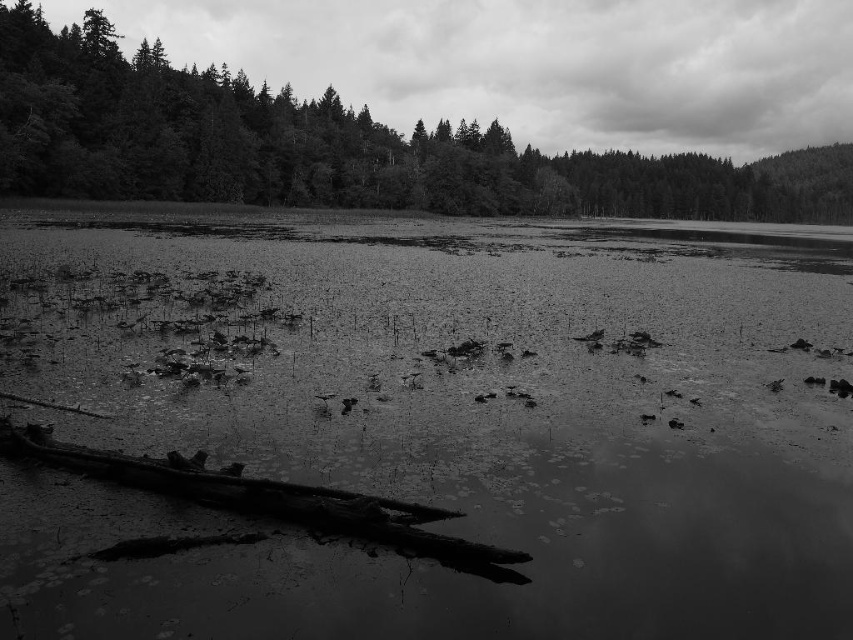
Is point (497, 608) less distant than point (317, 154)?

Yes, point (497, 608) is in front of point (317, 154).

Which is above, translucent murky water at center or smooth bark tree at center?

smooth bark tree at center is above.

Find the location of `translucent murky water at center`. translucent murky water at center is located at coordinates (440, 424).